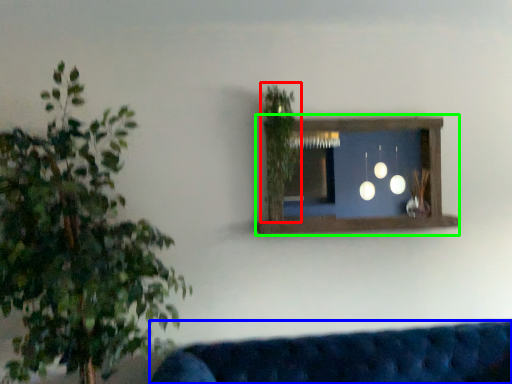
Question: Based on their relative distances, which object is nearer to plant (highlighted by a red box)? Choose from studio couch (highlighted by a blue box) and window frame (highlighted by a green box).

Choices:
 (A) studio couch
 (B) window frame

Answer: (B)